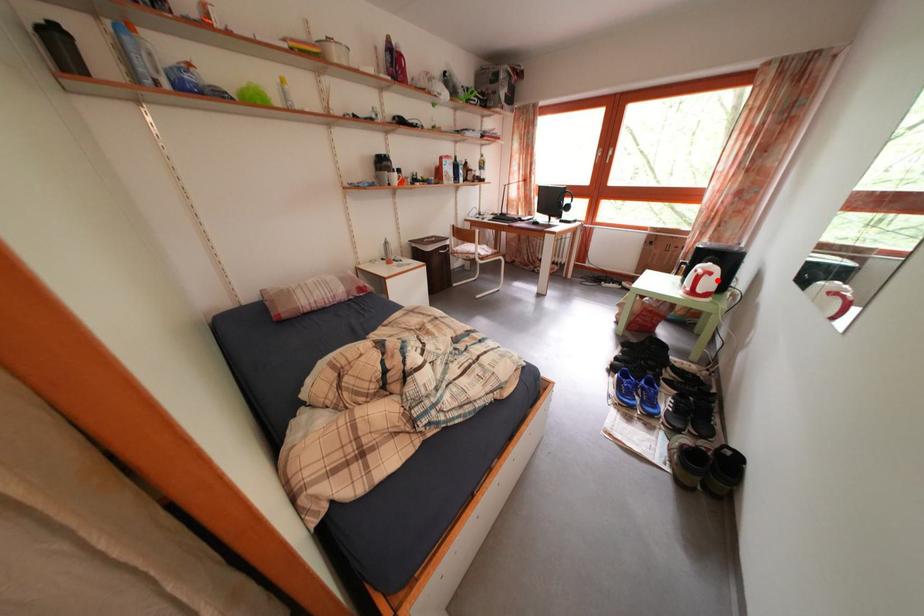
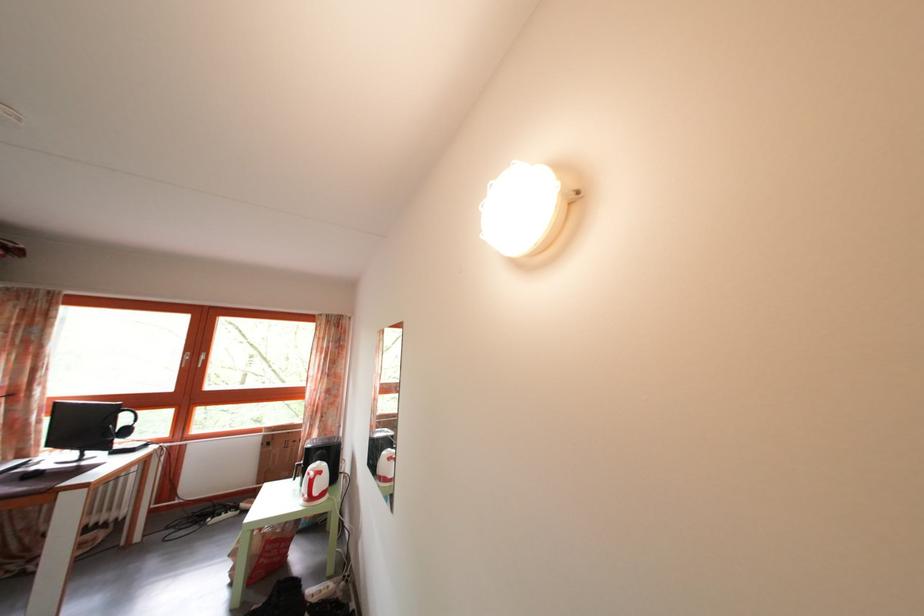
Find the pixel in the second image that matches the highlighted location in the first image.

(327, 480)